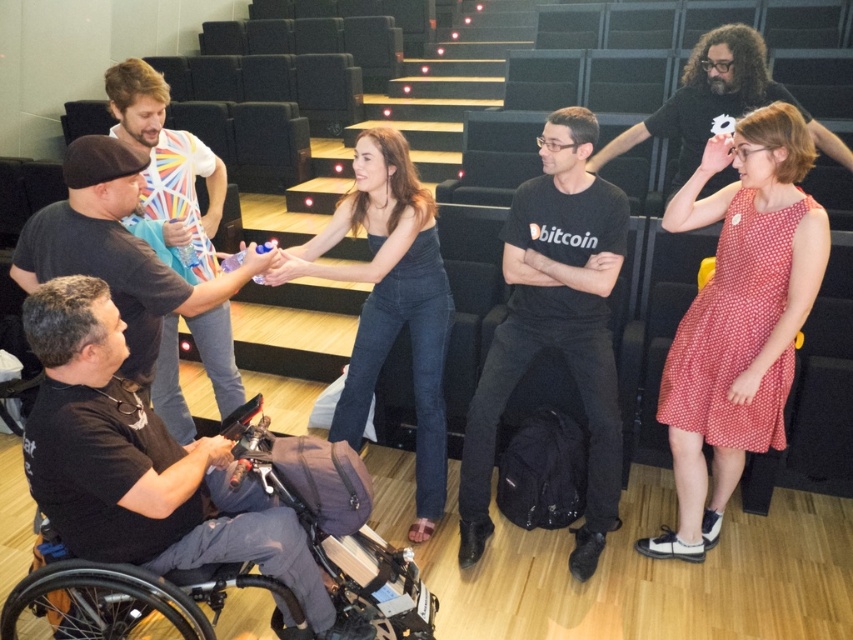
Can you confirm if black matte wheelchair at lower left is positioned to the right of dark brown hair at upper right?

In fact, black matte wheelchair at lower left is to the left of dark brown hair at upper right.

Who is more distant from viewer, (108, 224) or (688, 154)?

The point (688, 154) is more distant.

Find the location of `black matte wheelchair at lower left`. black matte wheelchair at lower left is located at coordinates (115, 250).

Between point (747, 356) and point (224, 356), which one is positioned behind?

Point (224, 356)

Can you confirm if red polka dot dress at center is positioned below white printed t-shirt at center?

Indeed, red polka dot dress at center is positioned under white printed t-shirt at center.

Between point (822, 272) and point (177, 168), which one is positioned in front?

Positioned in front is point (822, 272).

Find the location of `red polka dot dress at center`. red polka dot dress at center is located at coordinates (738, 316).

Identify the location of black plastic wheelchair at lower left. This screenshot has width=853, height=640. (335, 524).

Is point (397, 557) closer to camera compared to point (233, 406)?

That is True.

Where is `black plastic wheelchair at lower left`? The image size is (853, 640). black plastic wheelchair at lower left is located at coordinates (335, 524).